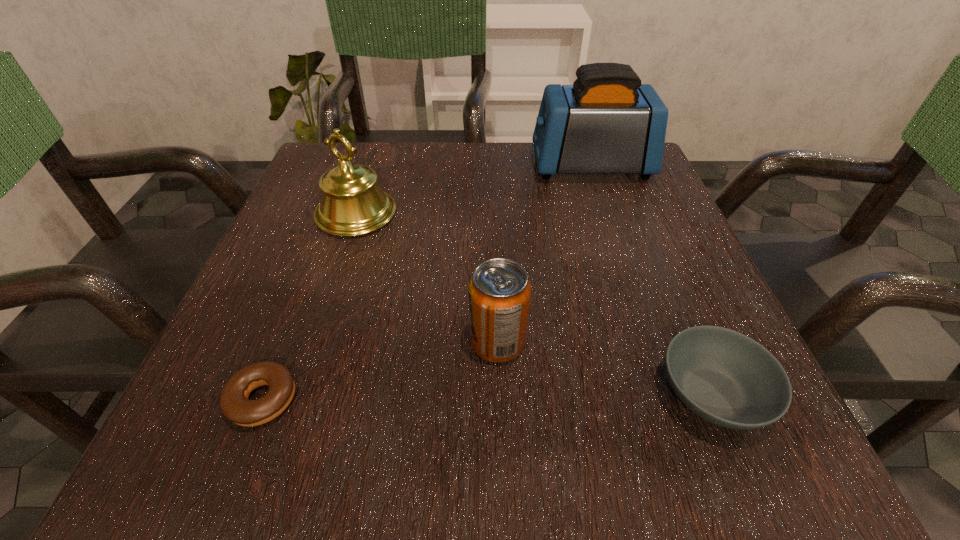
This screenshot has height=540, width=960. In order to click on the tallest object in this screenshot , I will do `click(607, 122)`.

You are a GUI agent. You are given a task and a screenshot of the screen. Output one action in this format:
    pyautogui.click(x=<x>, y=<y>)
    Task: Click on the farthest object
    
    Given the screenshot: What is the action you would take?
    pyautogui.click(x=607, y=122)

You are a GUI agent. You are given a task and a screenshot of the screen. Output one action in this format:
    pyautogui.click(x=<x>, y=<y>)
    Task: Click on the bell
    
    Given the screenshot: What is the action you would take?
    pyautogui.click(x=352, y=204)

Locate an element on the screen. the fourth shortest object is located at coordinates (352, 204).

Where is `the third object from left to right`? This screenshot has height=540, width=960. the third object from left to right is located at coordinates (499, 292).

The width and height of the screenshot is (960, 540). I want to click on the third shortest object, so click(499, 292).

This screenshot has width=960, height=540. In order to click on the second shortest object in this screenshot , I will do `click(725, 377)`.

Identify the location of doughnut. The height and width of the screenshot is (540, 960). (234, 403).

What are the coordinates of `vacant region located on the front-facing side of the tallest object` in the screenshot? It's located at (484, 166).

Where is `free space located on the front-facing side of the tallest object`? free space located on the front-facing side of the tallest object is located at coordinates (488, 166).